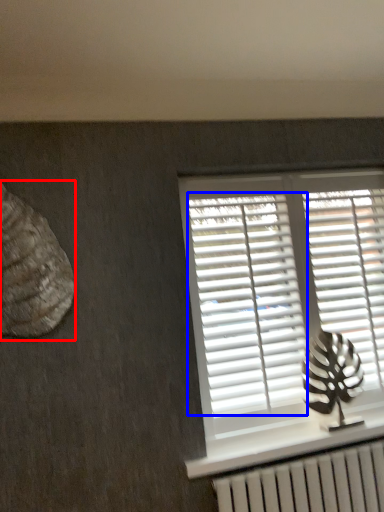
Question: Which object is further to the camera taking this photo, animal (highlighted by a red box) or shutter (highlighted by a blue box)?

Choices:
 (A) animal
 (B) shutter

Answer: (B)